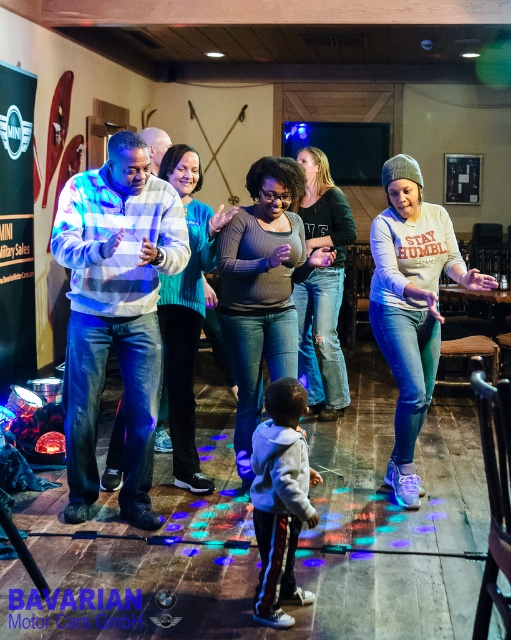
Question: Estimate the real-world distances between objects in this image. Which object is farther from the gray fleece jacket at center?

Choices:
 (A) striped sweater at center
 (B) dark green sweater at center

Answer: (B)

Question: Does gray fleece jacket at center have a smaller size compared to teal sweater at center?

Choices:
 (A) no
 (B) yes

Answer: (B)

Question: Among these objects, which one is farthest from the camera?

Choices:
 (A) gray knit beanie at upper right
 (B) teal sweater at center
 (C) matte gray sweater at center
 (D) dark green sweater at center

Answer: (D)

Question: Is gray knit beanie at upper right in front of teal sweater at center?

Choices:
 (A) no
 (B) yes

Answer: (B)

Question: Which point is farther from the camera taking this photo?

Choices:
 (A) (328, 416)
 (B) (377, 241)
 (C) (268, 157)
 (D) (276, 484)

Answer: (A)

Question: Is the position of striped sweater at center more distant than that of gray knit beanie at upper right?

Choices:
 (A) yes
 (B) no

Answer: (B)